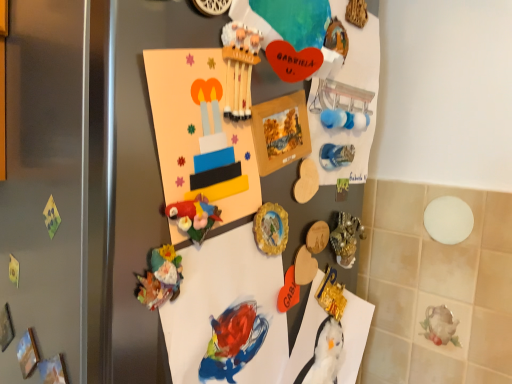
Question: Should I look upward or downward to see blue glossy magnet at upper right, the second art from the bottom?

Choices:
 (A) down
 (B) up

Answer: (B)

Question: Is gold metallic button at center oriented towards matte orange heart at center, which appears as the 3th toy when viewed from the top?

Choices:
 (A) no
 (B) yes

Answer: (A)

Question: From a real-world perspective, is gold metallic button at center physically below matte orange heart at center, which is the third toy from front to back?

Choices:
 (A) yes
 (B) no

Answer: (B)

Question: Considering the relative positions of gold metallic button at center and matte orange heart at center, which is the 3th toy from left to right, in the image provided, is gold metallic button at center to the right of matte orange heart at center, which is the 3th toy from left to right, from the viewer's perspective?

Choices:
 (A) yes
 (B) no

Answer: (B)

Question: Is gold metallic button at center placed right next to matte orange heart at center, which is the third toy from front to back?

Choices:
 (A) yes
 (B) no

Answer: (A)

Question: Is gold metallic button at center completely or partially outside of matte orange heart at center, which is the 3th toy from left to right?

Choices:
 (A) yes
 (B) no

Answer: (A)

Question: Can you confirm if gold metallic button at center is smaller than matte orange heart at center, which appears as the 3th toy when viewed from the top?

Choices:
 (A) no
 (B) yes

Answer: (A)

Question: Does matte paper postcard at center have a lesser width compared to gold metallic button at center?

Choices:
 (A) yes
 (B) no

Answer: (B)

Question: From a real-world perspective, is matte paper postcard at center physically above gold metallic button at center?

Choices:
 (A) yes
 (B) no

Answer: (A)

Question: Can you confirm if matte paper postcard at center is positioned to the left of gold metallic button at center?

Choices:
 (A) yes
 (B) no

Answer: (A)

Question: Is matte paper postcard at center smaller than gold metallic button at center?

Choices:
 (A) yes
 (B) no

Answer: (B)

Question: Is matte paper postcard at center directly adjacent to gold metallic button at center?

Choices:
 (A) yes
 (B) no

Answer: (B)

Question: Does matte paper postcard at center have a greater width compared to gold metallic button at center?

Choices:
 (A) yes
 (B) no

Answer: (A)

Question: From a real-world perspective, does matte orange heart at center, which is the third toy from front to back, stand above blue glossy magnet at upper right, the second art from the bottom?

Choices:
 (A) yes
 (B) no

Answer: (B)